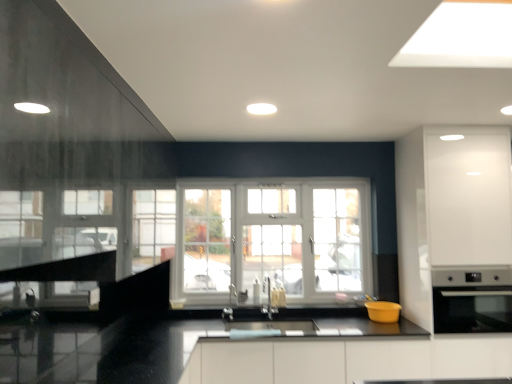
Question: Which direction should I rotate to look at yellow matte bowl at lower center, which ranks as the 2th appliance in right-to-left order?

Choices:
 (A) left
 (B) right

Answer: (B)

Question: Is satin nickel faucet at center, which is the second faucet from left to right, smaller than white plastic window at center?

Choices:
 (A) no
 (B) yes

Answer: (B)

Question: Is satin nickel faucet at center, which is the second faucet from left to right, wider than white plastic window at center?

Choices:
 (A) yes
 (B) no

Answer: (A)

Question: Is satin nickel faucet at center, which is the first faucet in right-to-left order, aimed at white plastic window at center?

Choices:
 (A) yes
 (B) no

Answer: (B)

Question: Does satin nickel faucet at center, which is the second faucet from left to right, contain white plastic window at center?

Choices:
 (A) no
 (B) yes

Answer: (A)

Question: Is satin nickel faucet at center, which is the second faucet from left to right, shorter than white plastic window at center?

Choices:
 (A) no
 (B) yes

Answer: (B)

Question: Is the depth of satin nickel faucet at center, which is the second faucet from left to right, less than that of white plastic window at center?

Choices:
 (A) no
 (B) yes

Answer: (B)

Question: Is the depth of satin nickel faucet at center, which is the first faucet in right-to-left order, greater than that of yellow matte bowl at lower center, which ranks as the 2th appliance in right-to-left order?

Choices:
 (A) yes
 (B) no

Answer: (A)

Question: Does satin nickel faucet at center, which is the second faucet from left to right, have a greater height compared to yellow matte bowl at lower center, the first appliance when ordered from left to right?

Choices:
 (A) no
 (B) yes

Answer: (B)

Question: From a real-world perspective, is satin nickel faucet at center, which is the first faucet in right-to-left order, positioned under yellow matte bowl at lower center, which ranks as the 2th appliance in right-to-left order, based on gravity?

Choices:
 (A) yes
 (B) no

Answer: (B)

Question: Is satin nickel faucet at center, which is the second faucet from left to right, wider than yellow matte bowl at lower center, the first appliance when ordered from left to right?

Choices:
 (A) yes
 (B) no

Answer: (B)

Question: Is satin nickel faucet at center, which is the first faucet in right-to-left order, in contact with yellow matte bowl at lower center, which ranks as the 2th appliance in right-to-left order?

Choices:
 (A) yes
 (B) no

Answer: (B)

Question: Is satin nickel faucet at center, which is the first faucet in right-to-left order, facing towards yellow matte bowl at lower center, the first appliance when ordered from left to right?

Choices:
 (A) yes
 (B) no

Answer: (B)

Question: Is yellow matte bowl at lower center, which ranks as the 2th appliance in right-to-left order, oriented towards satin nickel faucet at center, which is the second faucet from left to right?

Choices:
 (A) yes
 (B) no

Answer: (B)